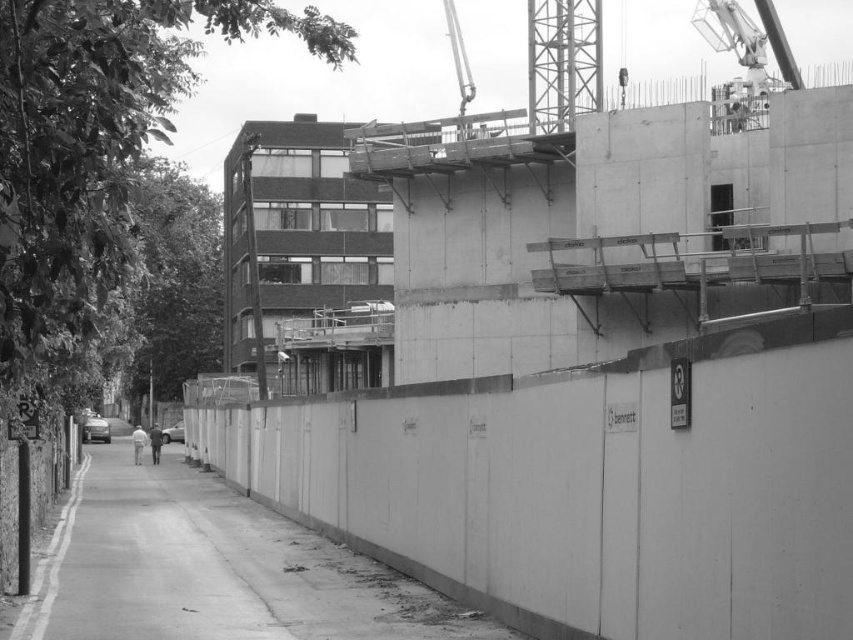
Does point (370, 627) come behind point (167, 436)?

No.

How far apart are smooth concrete wall at center and metallic silver car at center?

smooth concrete wall at center and metallic silver car at center are 45.80 meters apart from each other.

Does point (310, 584) lie in front of point (177, 438)?

Yes, point (310, 584) is in front of point (177, 438).

Where is `smooth concrete wall at center`? This screenshot has width=853, height=640. smooth concrete wall at center is located at coordinates (212, 568).

Does shiny silver car at lower left come behind metallic silver car at center?

No, it is not.

Can you confirm if shiny silver car at lower left is shorter than metallic silver car at center?

No, shiny silver car at lower left is not shorter than metallic silver car at center.

Identify the location of shiny silver car at lower left. The image size is (853, 640). (96, 429).

Does point (265, 614) lie behind point (96, 428)?

No, it is in front of (96, 428).

Is smooth concrete wall at center taller than shiny silver car at lower left?

Incorrect, smooth concrete wall at center's height is not larger of shiny silver car at lower left's.

Locate an element on the screen. smooth concrete wall at center is located at coordinates (212, 568).